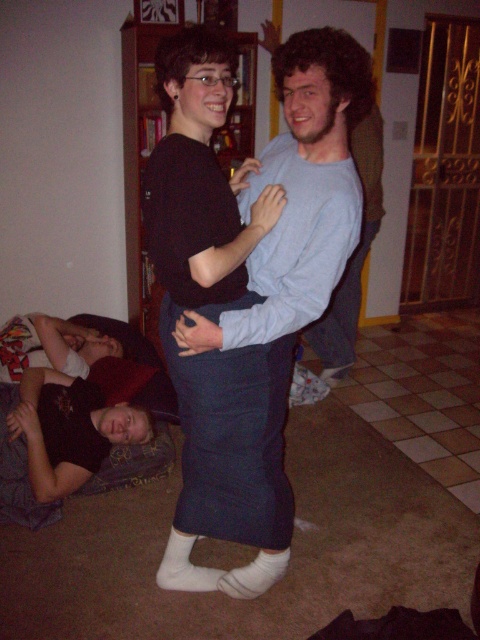
You are designing a layout for a fashion catalog and need to place the black matte skirt at center and the white cotton socks at lower center. Considering their widths, which item should be placed in a wider space to accommodate its size?

The black matte skirt at center is wider than the white cotton socks at lower center, so it should be placed in a wider space to accommodate its size.

You are standing in the room and want to take a photo of the point at coordinates [287,532]. Based on its distance from the camera, will the point be in focus if your camera has a depth of field that can focus on objects between 1.5 meters and 2.5 meters away?

The point at coordinates [287,532] is 1.91 meters from the camera, which falls within the depth of field range of 1.5 to 2.5 meters. Therefore, the point will be in focus.